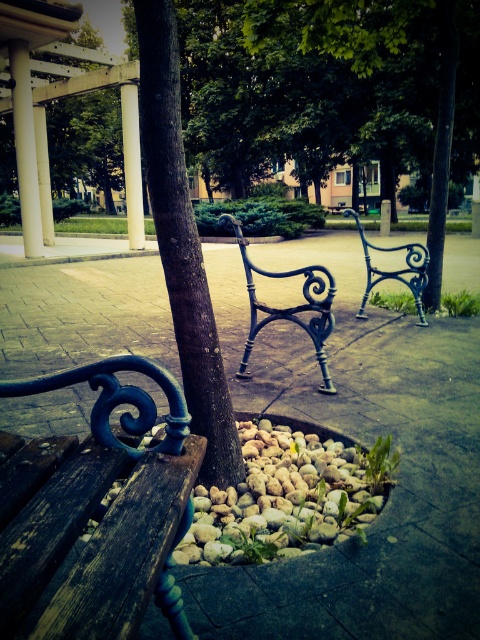
You are standing in the park and want to take a photo that includes both point (192, 234) and point (251, 330). Since one is closer to you than the other, will you need to adjust your camera angle to ensure both points are in focus?

Yes, you need to adjust your camera angle because point (192, 234) is closer to the camera than point (251, 330), so to ensure both are in focus, you should position the camera so that the depth of field captures both distances.

You are sitting on the wooden bench in the foreground of the park scene. You notice the brown rough tree trunk at center and the black wrought iron bench at center. Which object is closer to you?

The brown rough tree trunk at center is closer to you because it is positioned in front of the black wrought iron bench at center.

You are a park maintenance worker needing to place a new bench between the brown rough tree trunk at center and the smooth concrete pillar at center. The bench requires 10 feet of space to be placed safely. Is there enough space between them?

The brown rough tree trunk at center is 41.70 feet from the smooth concrete pillar at center, so yes, there is more than enough space to place the bench safely between them since the required space is only 10 feet.